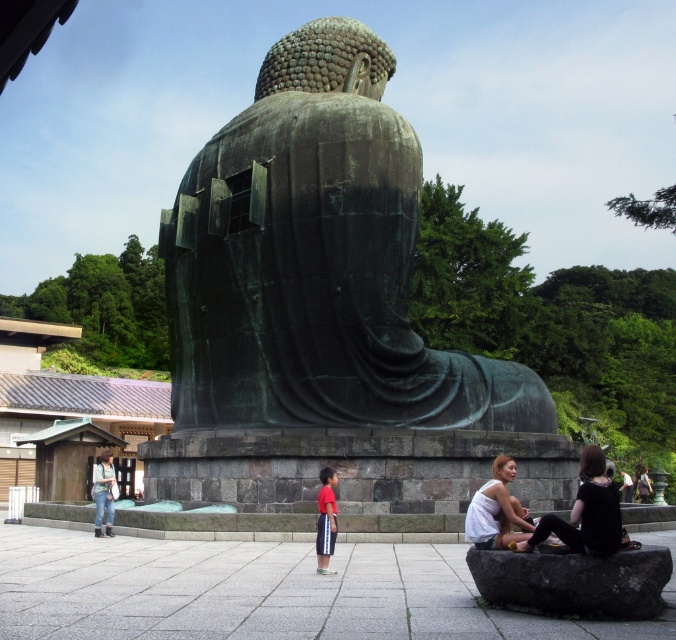
You are a photographer trying to capture a photo of the green patina bronze statue at center and the white matte shirt at lower right in the same frame. Based on their sizes, which object should you focus on first to ensure both are in focus?

The green patina bronze statue at center is taller than the white matte shirt at lower right, so you should focus on the green patina bronze statue at center first to ensure both are in focus.

You are a tour guide leading a group to the green patina bronze statue at center. A tourist asks if they can place a black fabric dress at lower right near the statue. Considering the minimum safety distance of 2 meters required between visitors and the statue, can they place it there?

The green patina bronze statue at center is 18.95 meters away from the black fabric dress at lower right, so yes, they can place it there as the distance is well beyond the 2 meter safety requirement.